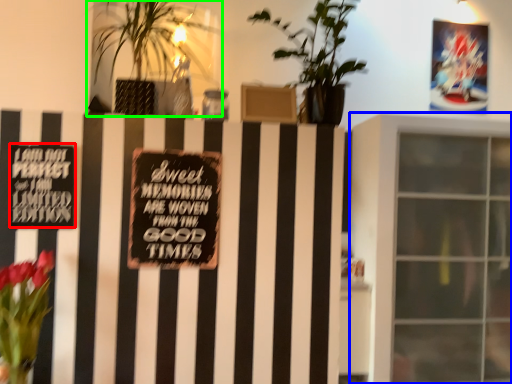
Question: Based on their relative distances, which object is nearer to plaque (highlighted by a red box)? Choose from window (highlighted by a blue box) and houseplant (highlighted by a green box).

Choices:
 (A) window
 (B) houseplant

Answer: (B)